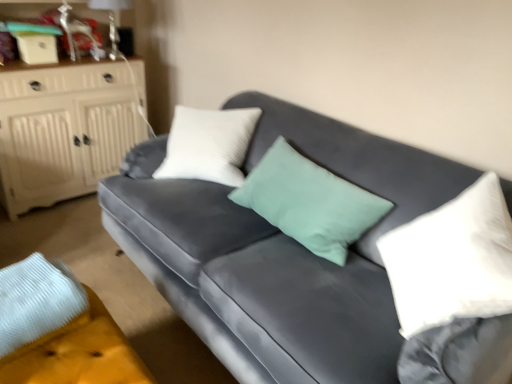
Question: Is velvet yellow footrest at lower left not within white soft pillow at right?

Choices:
 (A) yes
 (B) no

Answer: (A)

Question: From the image's perspective, is velvet yellow footrest at lower left under white soft pillow at right?

Choices:
 (A) no
 (B) yes

Answer: (B)

Question: Is white soft pillow at right a part of velvet yellow footrest at lower left?

Choices:
 (A) yes
 (B) no

Answer: (B)

Question: Are velvet yellow footrest at lower left and white soft pillow at right beside each other?

Choices:
 (A) no
 (B) yes

Answer: (A)

Question: Can you confirm if velvet yellow footrest at lower left is wider than white soft pillow at right?

Choices:
 (A) no
 (B) yes

Answer: (B)

Question: Does point (7, 336) appear closer or farther from the camera than point (374, 269)?

Choices:
 (A) closer
 (B) farther

Answer: (A)

Question: Is velvet yellow footrest at lower left taller or shorter than velvet gray couch at center?

Choices:
 (A) tall
 (B) short

Answer: (B)

Question: Is velvet yellow footrest at lower left to the left or to the right of velvet gray couch at center in the image?

Choices:
 (A) right
 (B) left

Answer: (B)

Question: In terms of size, does velvet yellow footrest at lower left appear bigger or smaller than velvet gray couch at center?

Choices:
 (A) big
 (B) small

Answer: (B)

Question: In terms of height, does white wood cabinet at left look taller or shorter compared to velvet gray couch at center?

Choices:
 (A) short
 (B) tall

Answer: (B)

Question: Is white wood cabinet at left in front of or behind velvet gray couch at center in the image?

Choices:
 (A) front
 (B) behind

Answer: (B)

Question: Is white wood cabinet at left inside the boundaries of velvet gray couch at center, or outside?

Choices:
 (A) outside
 (B) inside

Answer: (A)

Question: Does point (142, 120) appear closer or farther from the camera than point (182, 244)?

Choices:
 (A) closer
 (B) farther

Answer: (B)

Question: In the image, is velvet gray couch at center on the left side or the right side of velvet yellow footrest at lower left?

Choices:
 (A) right
 (B) left

Answer: (A)

Question: From the image's perspective, is velvet gray couch at center located above or below velvet yellow footrest at lower left?

Choices:
 (A) below
 (B) above

Answer: (B)